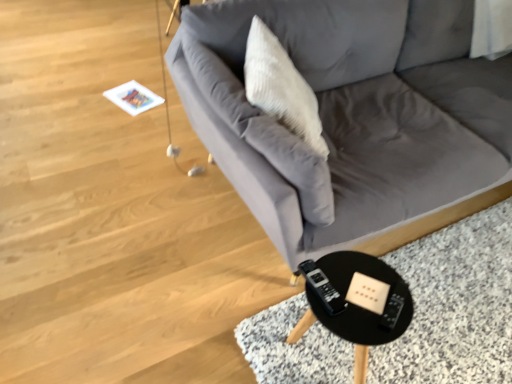
This screenshot has height=384, width=512. Find the location of `vacant area located to the right-hand side of black plastic table at lower right`. vacant area located to the right-hand side of black plastic table at lower right is located at coordinates (430, 344).